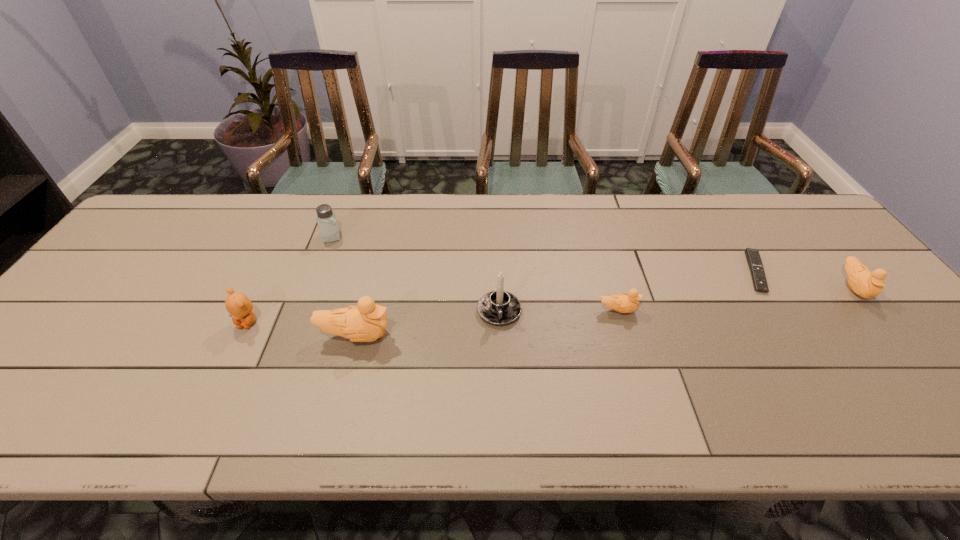
Identify the location of blank space that satisfies the following two spatial constraints: 1. on the face of the second shortest object; 2. on the face of the leftmost object. (621, 322).

This screenshot has width=960, height=540. I want to click on vacant space that satisfies the following two spatial constraints: 1. on the face of the second tallest duckling; 2. on the face of the second duckling from left to right, so click(873, 310).